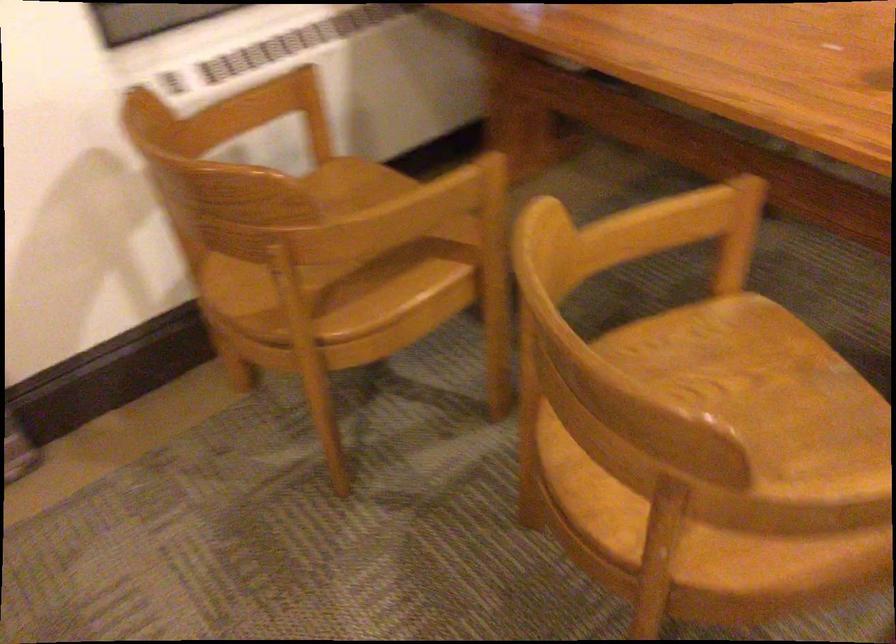
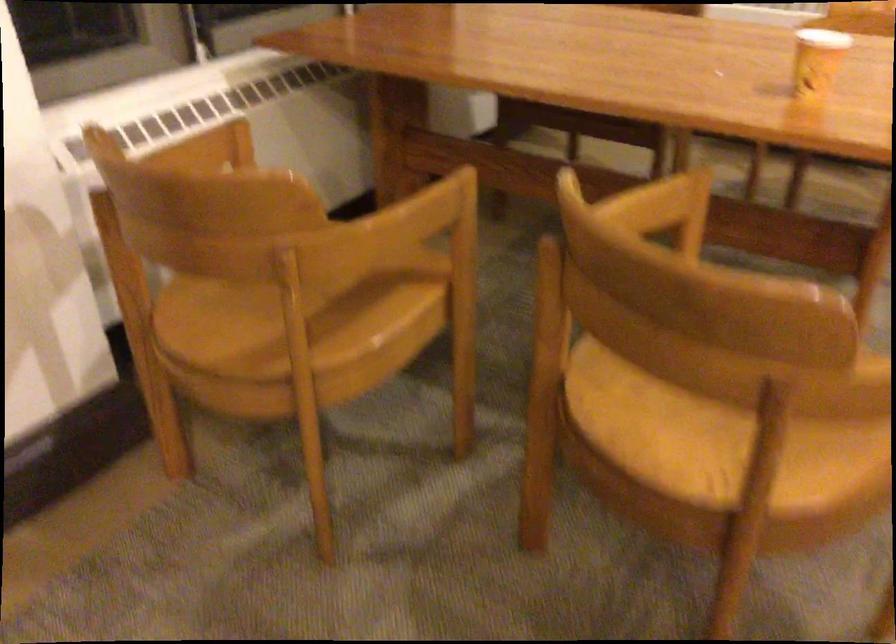
The point at (675,220) is marked in the first image. Where is the corresponding point in the second image?

(650, 205)